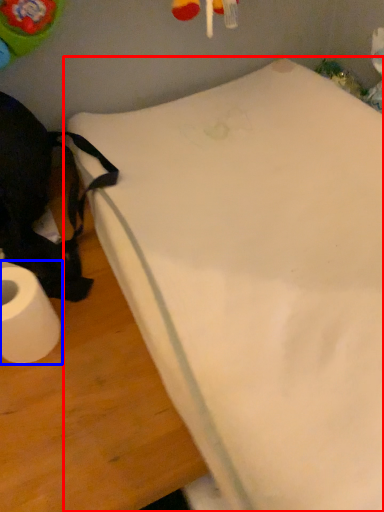
Question: Which object is closer to the camera taking this photo, furniture (highlighted by a red box) or toilet paper (highlighted by a blue box)?

Choices:
 (A) furniture
 (B) toilet paper

Answer: (A)